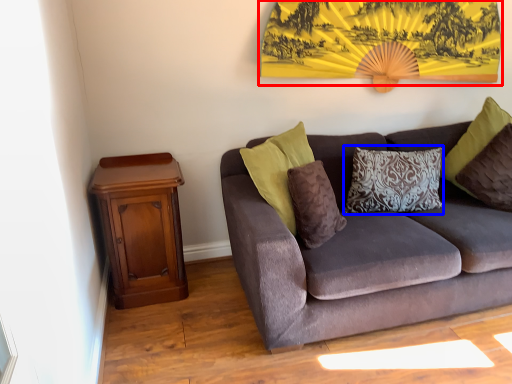
Question: Which object appears farthest to the camera in this image, mountain view (highlighted by a red box) or pillow (highlighted by a blue box)?

Choices:
 (A) mountain view
 (B) pillow

Answer: (B)